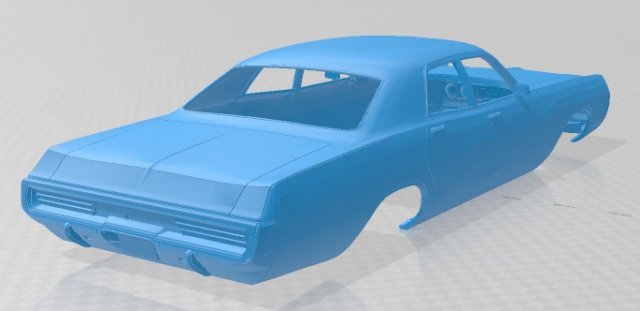
I want to click on door handle, so click(x=443, y=121), click(x=490, y=117).